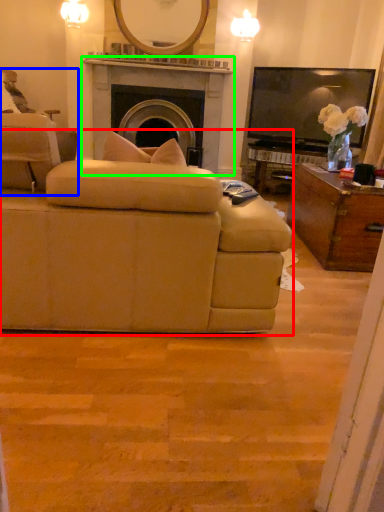
Question: Which is farther away from studio couch (highlighted by a red box)? chair (highlighted by a blue box) or fireplace (highlighted by a green box)?

Choices:
 (A) chair
 (B) fireplace

Answer: (B)